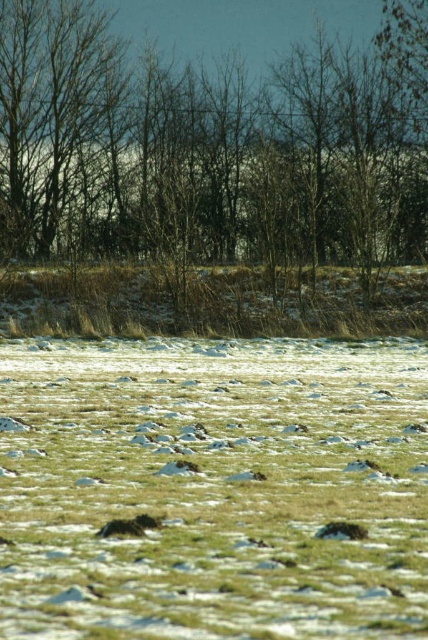
You are a gardener assessing the winter landscape. You notice the brown leafless tree at center and the dry grass at center. Which object occupies a larger area in the image?

The brown leafless tree at center is bigger than the dry grass at center, so the brown leafless tree at center occupies a larger area in the image.

You are standing in the winter field and notice the brown leafless tree at center and the dry grass at center. Which object is positioned higher relative to the other?

The brown leafless tree at center is located above the dry grass at center, so it is positioned higher.

You are a hiker trying to navigate through the winter field. You see the brown leafless tree at center and the dry grass at center. Which one is taller?

The brown leafless tree at center is much taller than the dry grass at center.